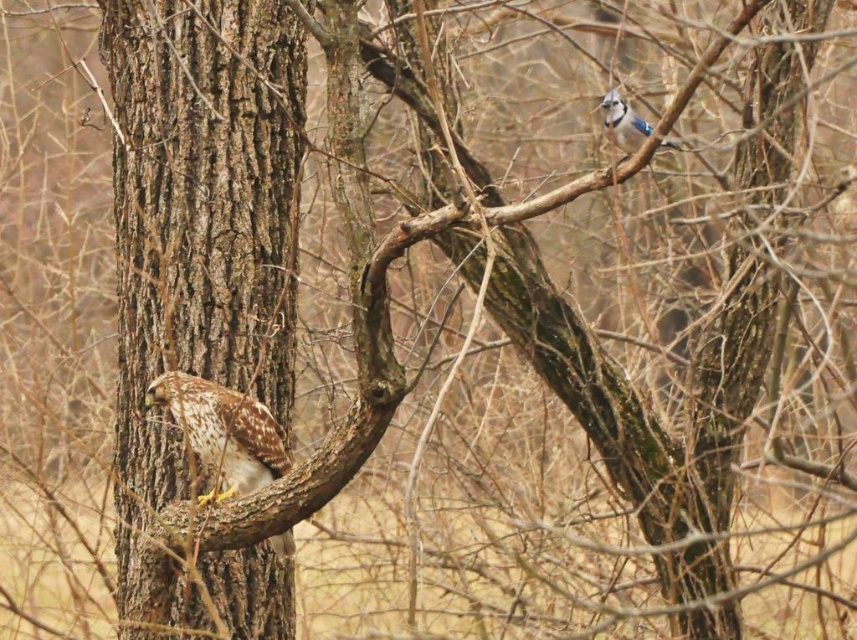
Based on the photo, can you confirm if brown rough bark tree trunk at left is thinner than brown speckled feathers at left?

No.

Who is positioned more to the left, brown rough bark tree trunk at left or brown speckled feathers at left?

From the viewer's perspective, brown rough bark tree trunk at left appears more on the left side.

The image size is (857, 640). I want to click on brown rough bark tree trunk at left, so click(x=199, y=220).

At what (x,y) coordinates should I click in order to perform the action: click on brown rough bark tree trunk at left. Please return your answer as a coordinate pair (x, y). The height and width of the screenshot is (640, 857). Looking at the image, I should click on (199, 220).

Based on the photo, who is lower down, brown speckled feathers at left or blue speckled feathers at upper right?

brown speckled feathers at left

Which is more to the left, brown speckled feathers at left or blue speckled feathers at upper right?

From the viewer's perspective, brown speckled feathers at left appears more on the left side.

Who is more forward, (216, 420) or (604, 109)?

Point (216, 420)

At what (x,y) coordinates should I click in order to perform the action: click on brown speckled feathers at left. Please return your answer as a coordinate pair (x, y). Looking at the image, I should click on (223, 432).

Measure the distance between brown rough bark tree trunk at left and blue speckled feathers at upper right.

brown rough bark tree trunk at left and blue speckled feathers at upper right are 6.03 feet apart.

What are the coordinates of `brown rough bark tree trunk at left` in the screenshot? It's located at (199, 220).